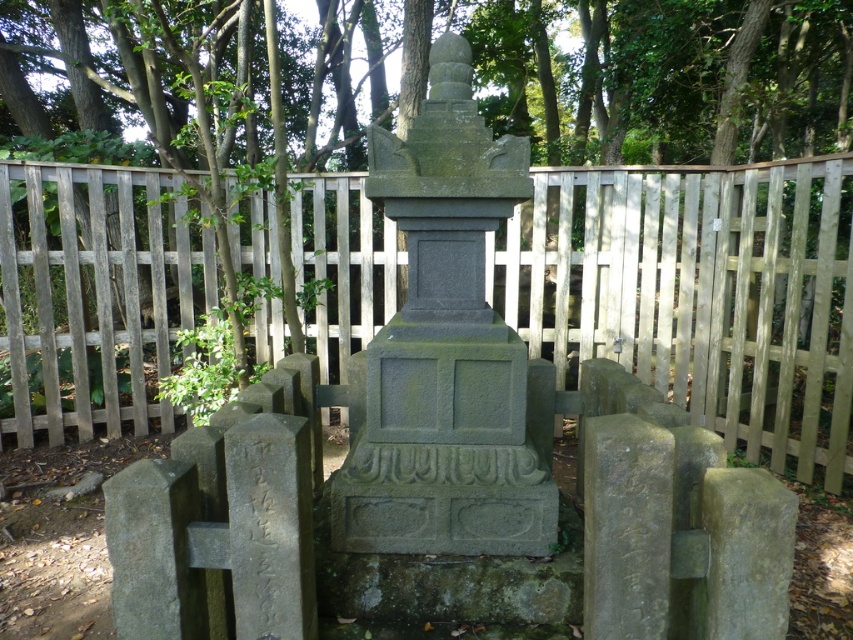
You are standing in the cemetery and want to take a photo of both the central stone monument and the smaller gravestones. If you focus your camera on point A at point (24,177) and point B at point (440,65), which point is closer to your camera lens?

Point A at point (24,177) is closer to the camera lens than point B at point (440,65) because the description states that point A is further to the camera than point B. Wait, there might be confusion here. Let me check again. The Objects Description says Point (24,177) is further to the camera than point (440,65). So actually, point A is further away from the camera, so point B is closer. Hmm, the user might have made a mistake in the answer. Let me correct that. The correct answer should be

You are visiting a cemetery and notice the wooden fence at center and the gray stone monument at center. Which structure is larger in size?

The gray stone monument at center is larger than the wooden fence at center.